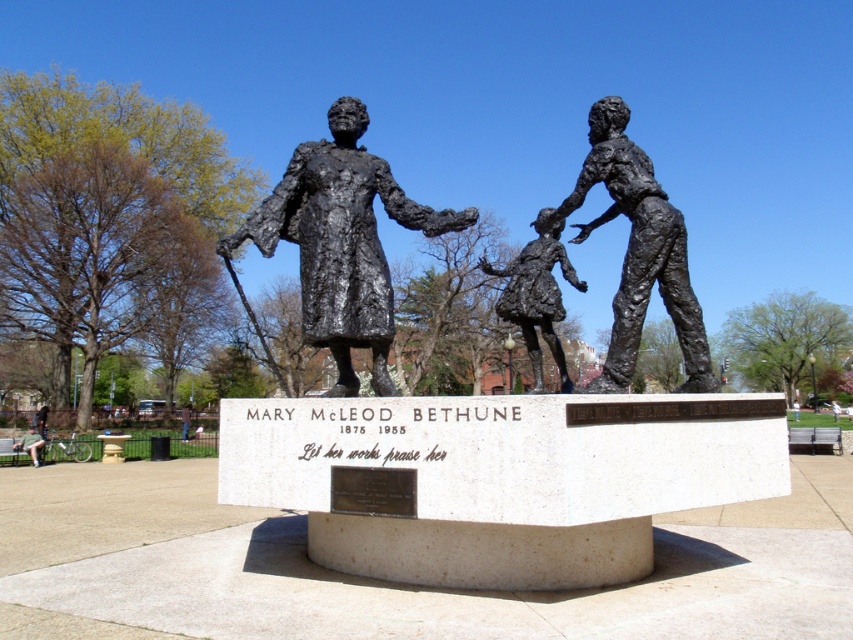
Question: Which object is positioned farthest from the bronze statue of child at right?

Choices:
 (A) shiny bronze girl at center
 (B) green fabric bench at lower left

Answer: (B)

Question: Is bronze statue at center bigger than bronze statue of child at right?

Choices:
 (A) yes
 (B) no

Answer: (A)

Question: Which of the following is the closest to the observer?

Choices:
 (A) (26, 438)
 (B) (183, 422)
 (C) (515, 257)
 (D) (599, 392)

Answer: (D)

Question: Is bronze statue at center thinner than shiny bronze girl at center?

Choices:
 (A) no
 (B) yes

Answer: (A)

Question: From the image, what is the correct spatial relationship of green fabric bench at lower left in relation to brown leather jacket at center?

Choices:
 (A) below
 (B) above

Answer: (B)

Question: Which object is positioned farthest from the green fabric bench at lower left?

Choices:
 (A) shiny bronze girl at center
 (B) bronze statue at center
 (C) brown leather jacket at center
 (D) bronze statue of child at right

Answer: (D)